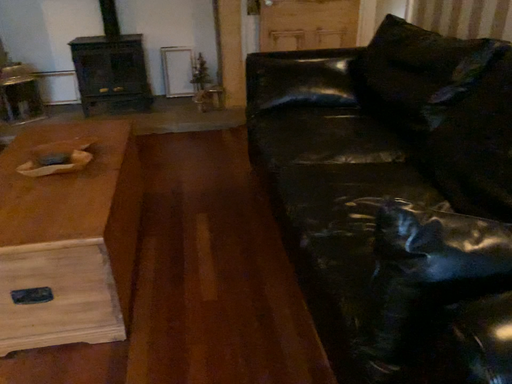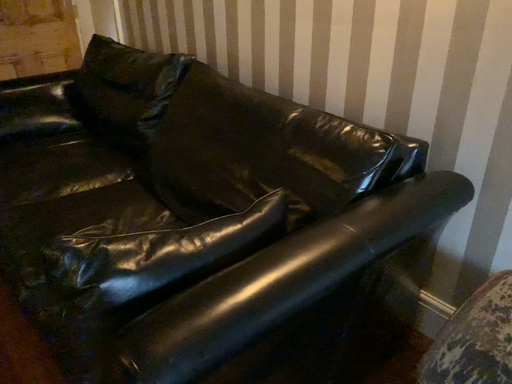
Question: Which way did the camera rotate in the video?

Choices:
 (A) rotated right
 (B) rotated left

Answer: (A)